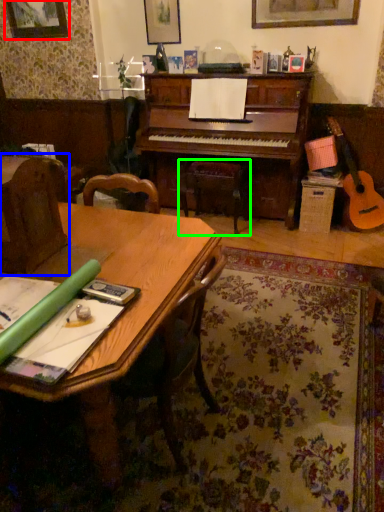
Question: Which object is positioned closest to picture frame (highlighted by a red box)? Select from armchair (highlighted by a blue box) and music stool (highlighted by a green box).

Choices:
 (A) armchair
 (B) music stool

Answer: (B)